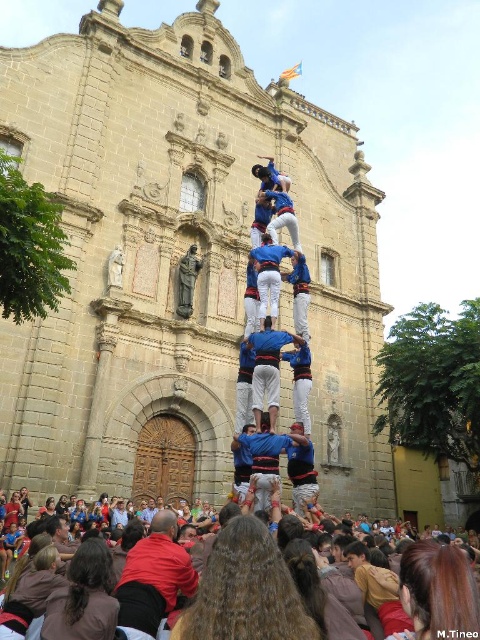
Which of these two, stone church at center or blue fabric shirt at center, stands taller?

stone church at center

Does stone church at center come behind blue fabric shirt at center?

Yes, stone church at center is further from the viewer.

In order to click on stone church at center in this screenshot , I will do `click(179, 262)`.

Measure the distance between red shirt at center and camera.

26.97 meters

Based on the photo, does red shirt at center appear on the left side of blue fabric shirt at center?

Indeed, red shirt at center is positioned on the left side of blue fabric shirt at center.

Is point (132, 548) positioned after point (277, 337)?

No, it is in front of (277, 337).

You are a GUI agent. You are given a task and a screenshot of the screen. Output one action in this format:
    pyautogui.click(x=<x>, y=<y>)
    Task: Click on the red shirt at center
    The image size is (480, 640).
    Given the screenshot: What is the action you would take?
    pyautogui.click(x=154, y=577)

Looking at this image, who is lower down, stone church at center or red shirt at center?

Positioned lower is red shirt at center.

Can you confirm if stone church at center is wider than red shirt at center?

Correct, the width of stone church at center exceeds that of red shirt at center.

Who is more distant from viewer, (167, 388) or (153, 550)?

Point (167, 388)

Image resolution: width=480 pixels, height=640 pixels. In order to click on stone church at center in this screenshot , I will do `click(179, 262)`.